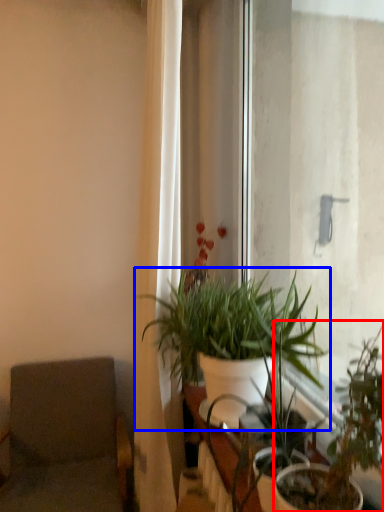
Question: Which of the following is the farthest to the observer, houseplant (highlighted by a red box) or houseplant (highlighted by a blue box)?

Choices:
 (A) houseplant
 (B) houseplant

Answer: (B)